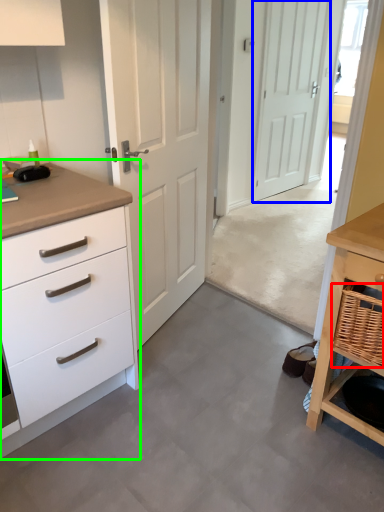
Question: Which object is the closest to the basket (highlighted by a red box)? Choose among these: door (highlighted by a blue box) or chest of drawers (highlighted by a green box).

Choices:
 (A) door
 (B) chest of drawers

Answer: (B)